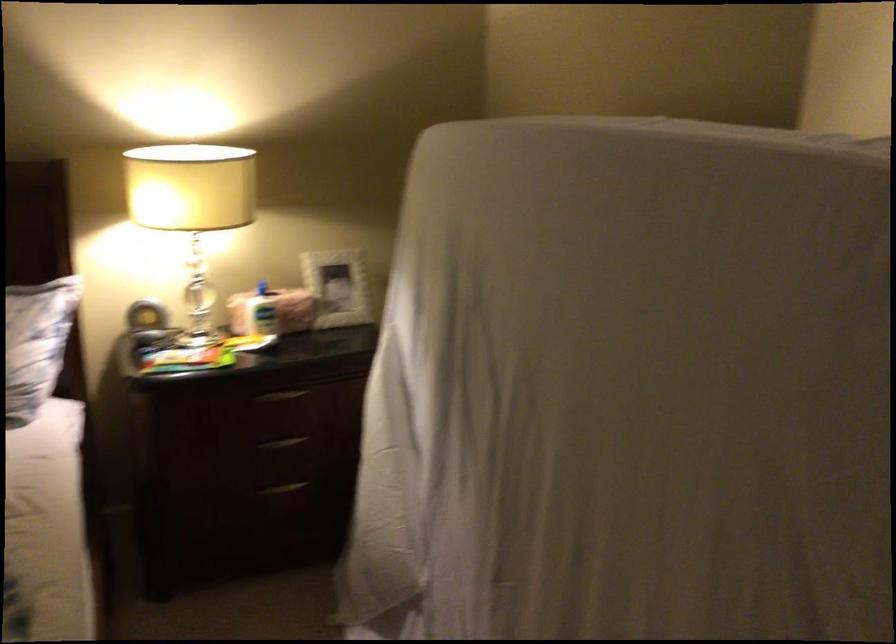
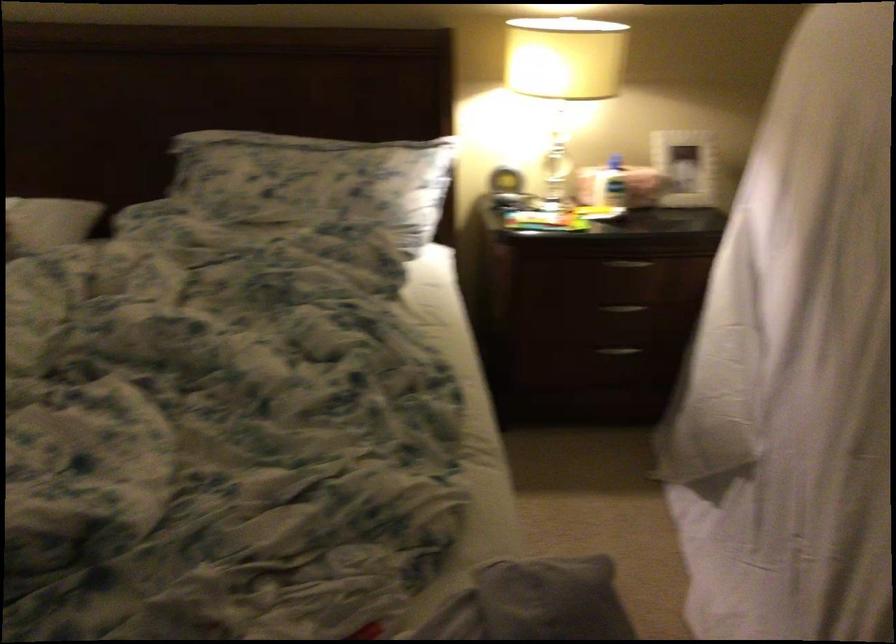
Question: The first image is from the beginning of the video and the second image is from the end. How did the camera likely rotate when shooting the video?

Choices:
 (A) Left
 (B) Right
 (C) Up
 (D) Down

Answer: (A)